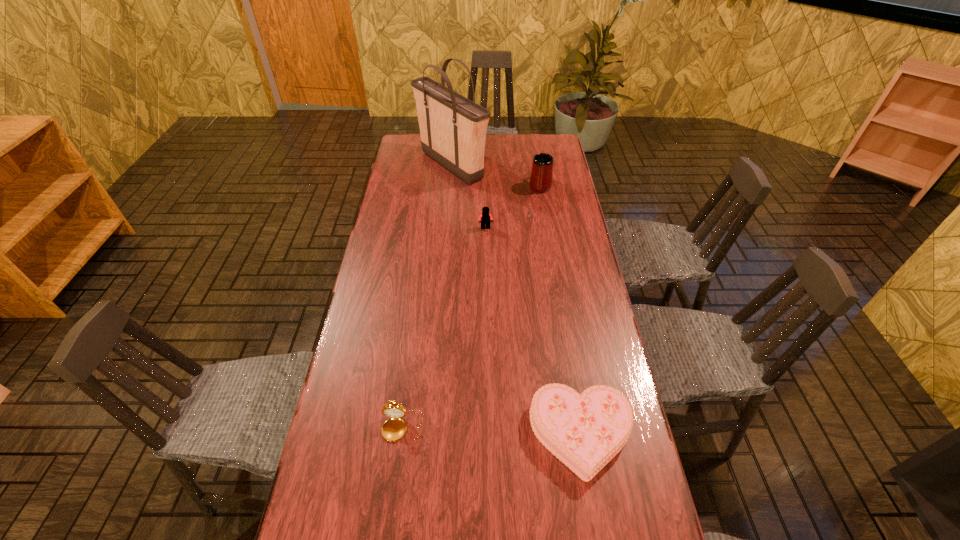
The height and width of the screenshot is (540, 960). I want to click on empty space that is in between the pocket watch and the fourth shortest object, so click(x=471, y=306).

Image resolution: width=960 pixels, height=540 pixels. Find the location of `object that is the fourth closest to the shopping bag`. object that is the fourth closest to the shopping bag is located at coordinates (394, 429).

Image resolution: width=960 pixels, height=540 pixels. In order to click on object that is the second closest one to the shortest object in this screenshot , I will do `click(485, 217)`.

Where is `free space that satisfies the following two spatial constraints: 1. on the front-facing side of the cake; 2. on the left side of the Lego`? The image size is (960, 540). free space that satisfies the following two spatial constraints: 1. on the front-facing side of the cake; 2. on the left side of the Lego is located at coordinates (489, 435).